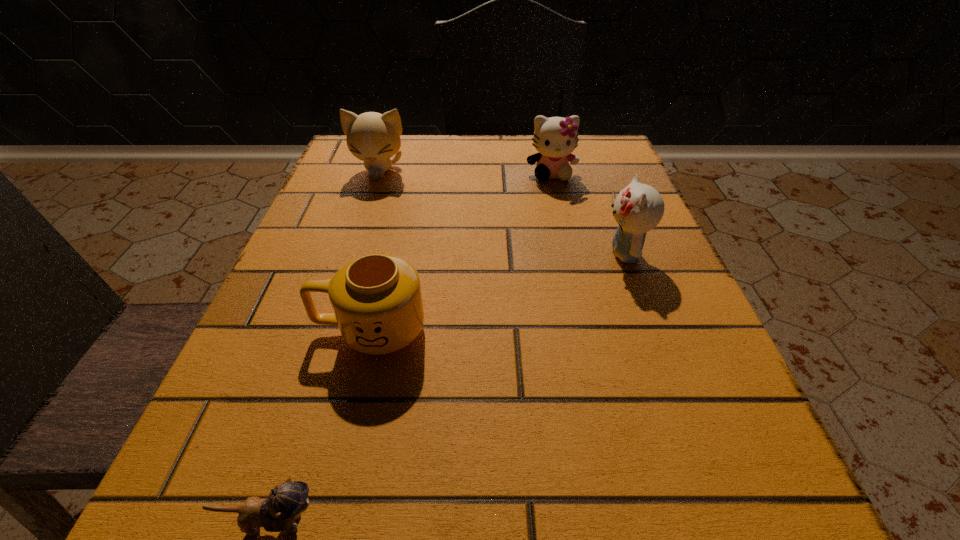
This screenshot has height=540, width=960. Find the location of `the third nearest object`. the third nearest object is located at coordinates (638, 208).

The image size is (960, 540). What are the coordinates of `the fourth farthest object` in the screenshot? It's located at (377, 301).

At what (x,y) coordinates should I click in order to perform the action: click on vacant space located 0.150m on the front-facing side of the third farthest object. Please return your answer as a coordinate pair (x, y). This screenshot has height=540, width=960. Looking at the image, I should click on (515, 253).

At what (x,y) coordinates should I click in order to perform the action: click on free point located on the front-facing side of the third farthest object. Please return your answer as a coordinate pair (x, y). The image size is (960, 540). Looking at the image, I should click on (543, 253).

Find the location of a particular element. The width and height of the screenshot is (960, 540). vacant point located on the front-facing side of the third farthest object is located at coordinates (456, 253).

Where is `vacant area situated 0.060m on the handle side of the mug`? The width and height of the screenshot is (960, 540). vacant area situated 0.060m on the handle side of the mug is located at coordinates (274, 330).

I want to click on vacant space located 0.070m on the handle side of the mug, so click(x=266, y=330).

This screenshot has height=540, width=960. I want to click on kitten located in the left edge section of the desktop, so click(374, 138).

Locate an element on the screen. The width and height of the screenshot is (960, 540). mug positioned at the left edge is located at coordinates (377, 301).

The image size is (960, 540). In order to click on object that is at the far left corner in this screenshot , I will do `click(374, 138)`.